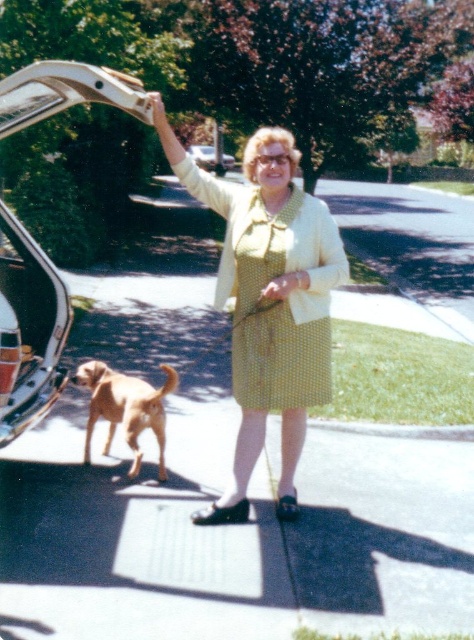
Question: Is metallic silver car at left to the right of metallic silver car at center from the viewer's perspective?

Choices:
 (A) no
 (B) yes

Answer: (B)

Question: Which of these objects is positioned closest to the yellow dotted dress at center?

Choices:
 (A) golden fur dog at lower left
 (B) metallic silver car at left
 (C) metallic silver car at center

Answer: (A)

Question: Is yellow dotted dress at center smaller than golden fur dog at lower left?

Choices:
 (A) yes
 (B) no

Answer: (B)

Question: Which point appears farthest from the camera in this image?

Choices:
 (A) (11, 115)
 (B) (114, 419)
 (C) (193, 156)

Answer: (C)

Question: Does metallic silver car at left appear on the right side of metallic silver car at center?

Choices:
 (A) no
 (B) yes

Answer: (B)

Question: Which point appears closest to the camera in this image?

Choices:
 (A) (201, 150)
 (B) (49, 301)
 (C) (91, 420)

Answer: (C)